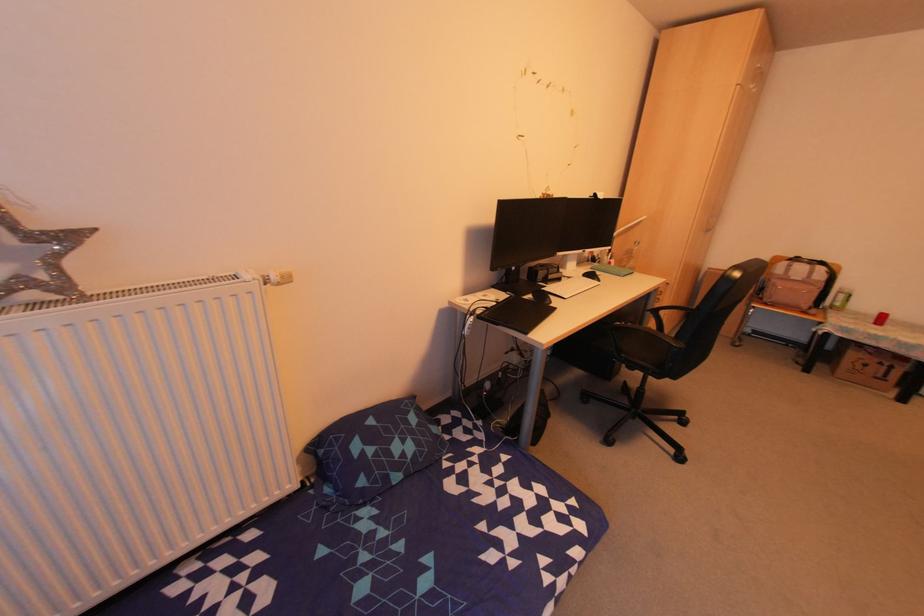
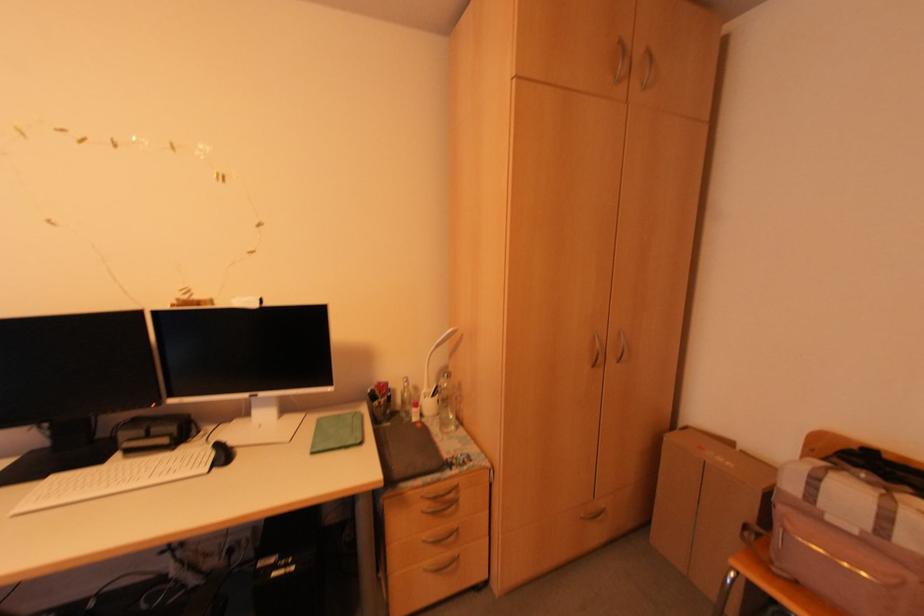
In the second image, find the point that corresponds to [609,259] in the first image.

(431, 395)